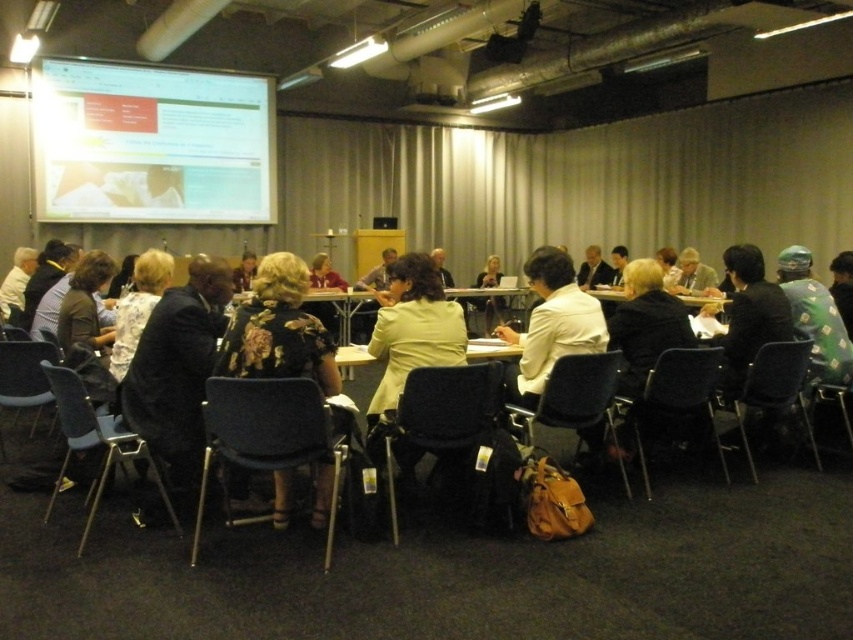
Question: Can you confirm if floral-patterned dress at center is positioned below blue fabric chair at center?

Choices:
 (A) yes
 (B) no

Answer: (B)

Question: Can you confirm if black suit at left is positioned to the left of black plastic chair at center?

Choices:
 (A) yes
 (B) no

Answer: (A)

Question: Estimate the real-world distances between objects in this image. Which object is closer to the floral-patterned dress at center?

Choices:
 (A) white glossy projection screen at upper left
 (B) black suit at left
 (C) matte black chair at lower right

Answer: (B)

Question: Considering the real-world distances, which object is farthest from the blue fabric chair at center?

Choices:
 (A) floral-patterned dress at center
 (B) matte black chair at lower right

Answer: (B)

Question: Which object appears farthest from the camera in this image?

Choices:
 (A) black plastic chair at center
 (B) floral-patterned dress at center
 (C) black fabric chair at center

Answer: (A)

Question: Can you confirm if black fabric chair at center is positioned to the right of dark blue plastic chair at center?

Choices:
 (A) no
 (B) yes

Answer: (A)